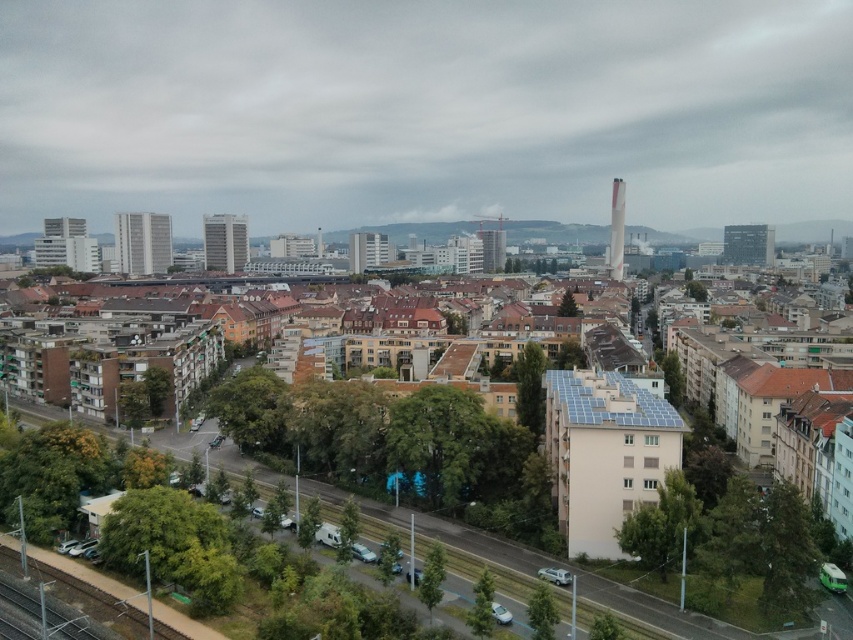
Can you confirm if green metallic train track at lower left is positioned to the left of matte gray building at center?

No, green metallic train track at lower left is not to the left of matte gray building at center.

Is point (115, 621) closer to camera compared to point (210, 259)?

Yes, point (115, 621) is in front of point (210, 259).

Locate an element on the screen. This screenshot has width=853, height=640. green metallic train track at lower left is located at coordinates (91, 600).

Is matte gray building at center taller than matte glass building at center?

No, matte gray building at center is not taller than matte glass building at center.

Which is more to the right, matte gray building at center or matte glass building at center?

matte glass building at center

Does point (230, 234) come farther from viewer compared to point (489, 244)?

No, it is not.

Find the location of a particular element. This screenshot has height=640, width=853. matte gray building at center is located at coordinates (225, 243).

From the picture: Does white glass building at center have a lesser height compared to white glossy obelisk at center-right?

Yes, white glass building at center is shorter than white glossy obelisk at center-right.

Does white glass building at center appear over white glossy obelisk at center-right?

Actually, white glass building at center is below white glossy obelisk at center-right.

Who is more distant from viewer, [350,243] or [612,205]?

The point [612,205] is more distant.

Find the location of a particular element. white glass building at center is located at coordinates (367, 250).